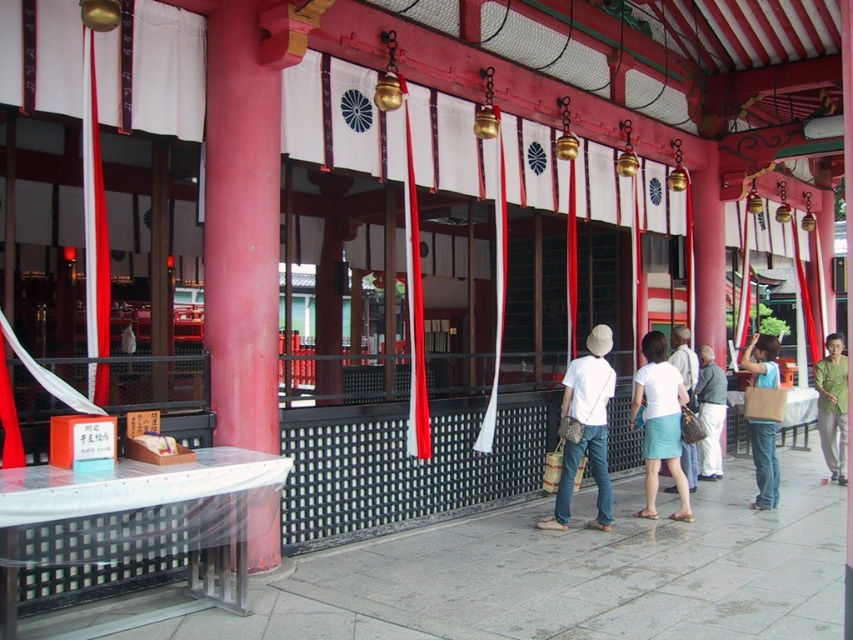
You are standing in front of the traditional Japanese shrine and want to find a specific location marked by the point at coordinates (660, 422). Based on the scene description, where would this point most likely be located?

The point at coordinates (660, 422) is on the white cotton skirt at center.

You are standing in front of the shrine and want to take a photo of both the point at coordinates (645, 339) and the point at (709, 394). Which point will appear larger in your photo?

The point at coordinates (645, 339) will appear larger in your photo because it is closer to the camera than the point at (709, 394).